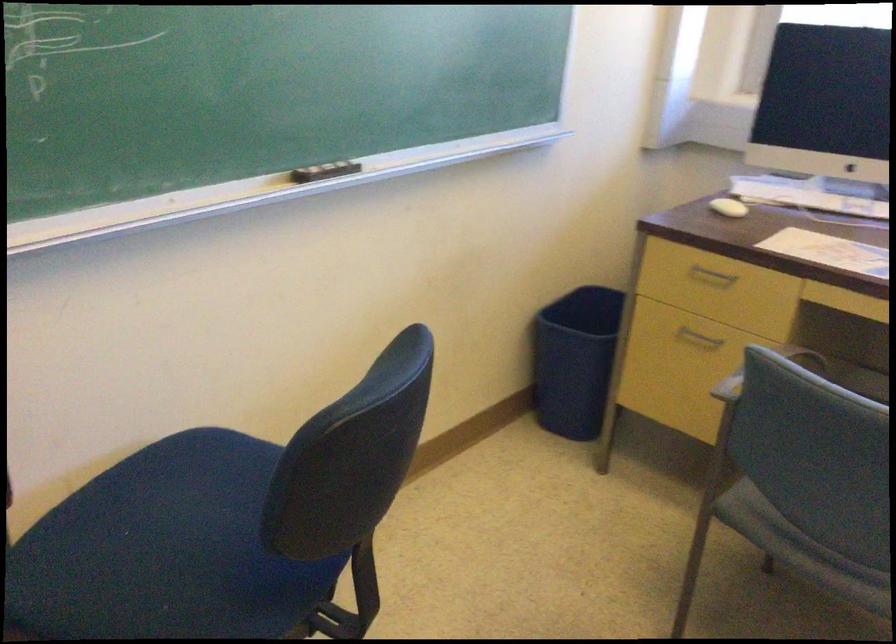
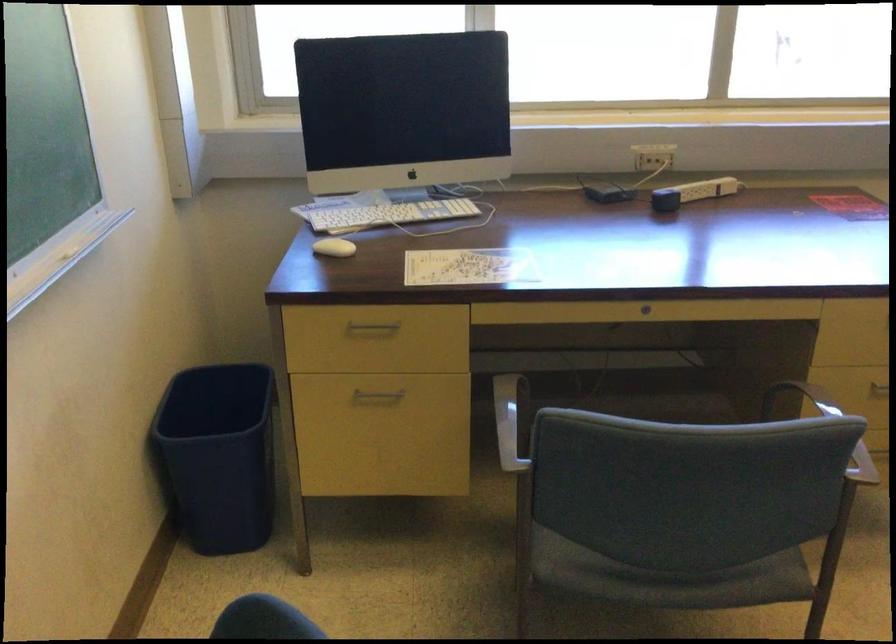
Find the pixel in the second image that matches the point at 819,198 in the first image.

(389, 214)